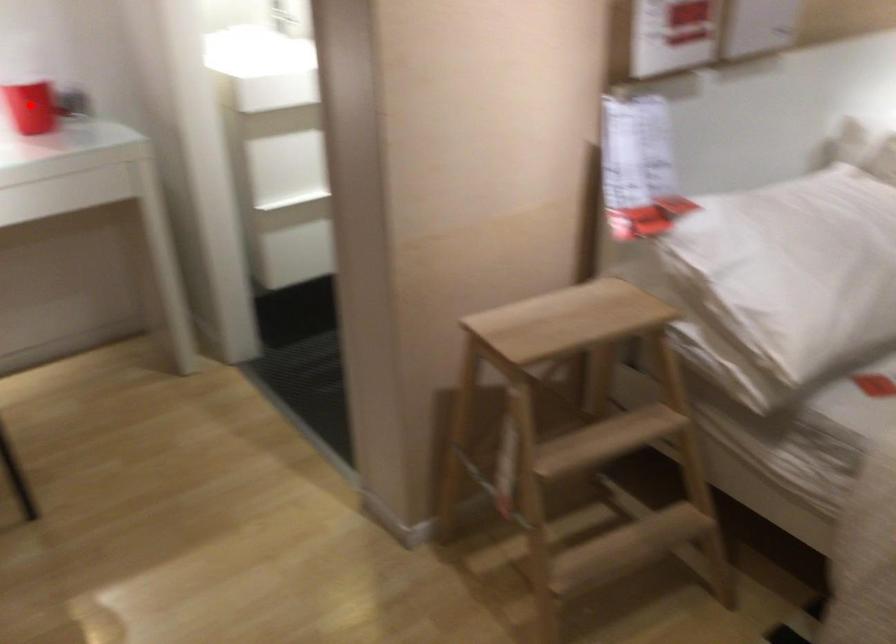
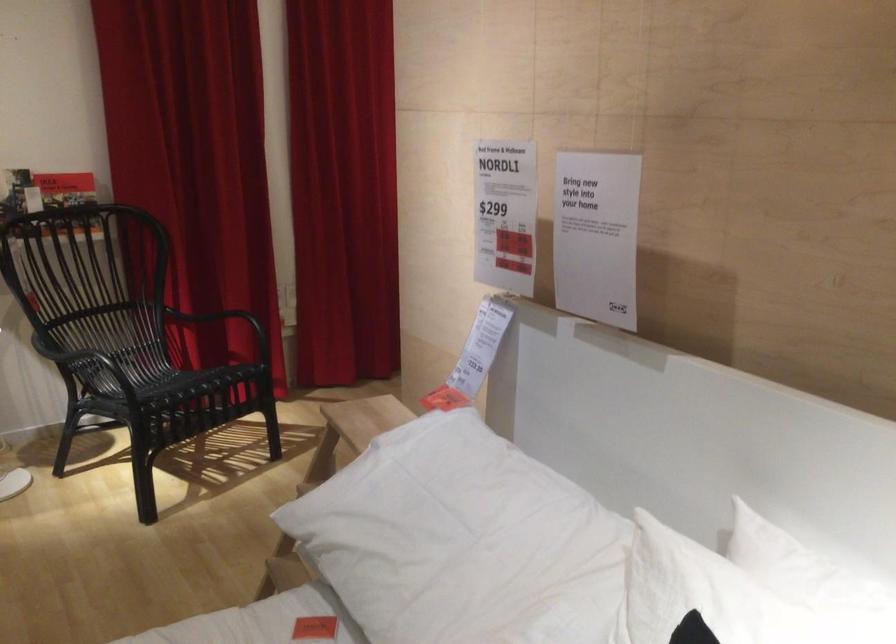
Question: I am providing you with two images of the same scene from different viewpoints. A red point is marked on the first image. Can you still see the location of the red point in image 2?

Choices:
 (A) Yes
 (B) No

Answer: (B)